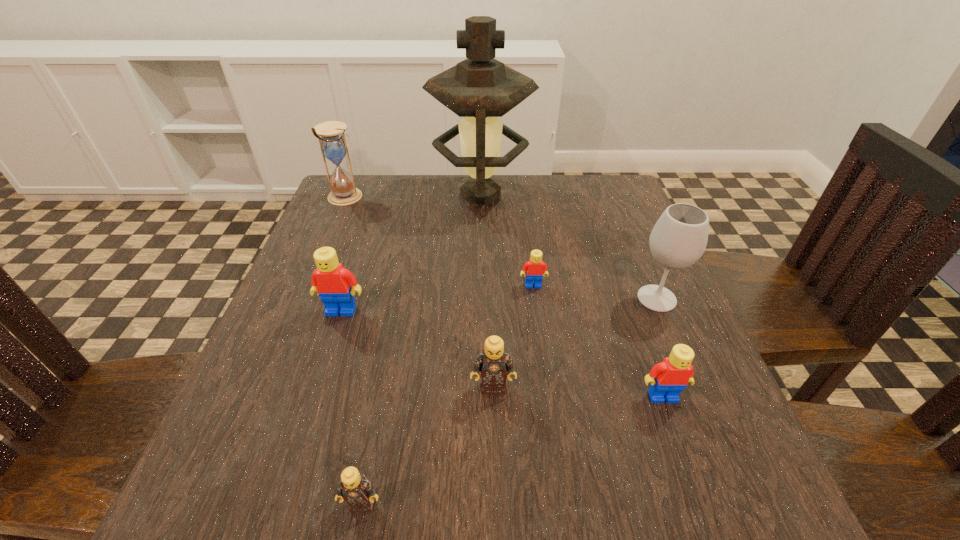
This screenshot has width=960, height=540. Find the location of `the second red Lego from left to right`. the second red Lego from left to right is located at coordinates (535, 268).

The image size is (960, 540). Find the location of `the third object from left to right`. the third object from left to right is located at coordinates (355, 489).

Locate an element on the screen. the smaller tan Lego is located at coordinates (355, 489).

Where is `free space located 0.240m on the front of the tallest object`? The image size is (960, 540). free space located 0.240m on the front of the tallest object is located at coordinates (481, 287).

Where is `free space located 0.180m on the front of the hourglass`? The image size is (960, 540). free space located 0.180m on the front of the hourglass is located at coordinates (321, 254).

Locate an element on the screen. The height and width of the screenshot is (540, 960). vacant region located on the back of the wineglass is located at coordinates (636, 249).

This screenshot has width=960, height=540. In order to click on vacant space located on the face of the leftmost red Lego in this screenshot , I will do coord(310,407).

Locate an element on the screen. The image size is (960, 540). free space located in front of the third Lego from right to left is located at coordinates (496, 523).

The height and width of the screenshot is (540, 960). I want to click on vacant space located on the face of the second biggest red Lego, so click(678, 441).

This screenshot has height=540, width=960. I want to click on vacant space located on the face of the second red Lego from right to left, so [x=549, y=408].